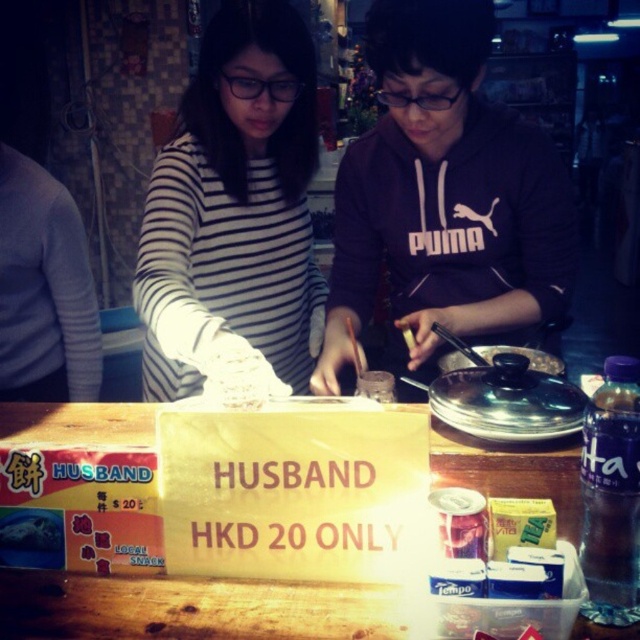
You are a customer at this night market and want to grab the white matte gloves at center and the wooden table at center. Which one can you reach first without moving your position?

The white matte gloves at center is closer to you than the wooden table at center, so you can reach the white matte gloves at center first without moving your position.

You are a customer at this night market and want to place your order. You notice the striped fabric shirt at left and the wooden table at center. Which object is wider?

The striped fabric shirt at left is wider than the wooden table at center.